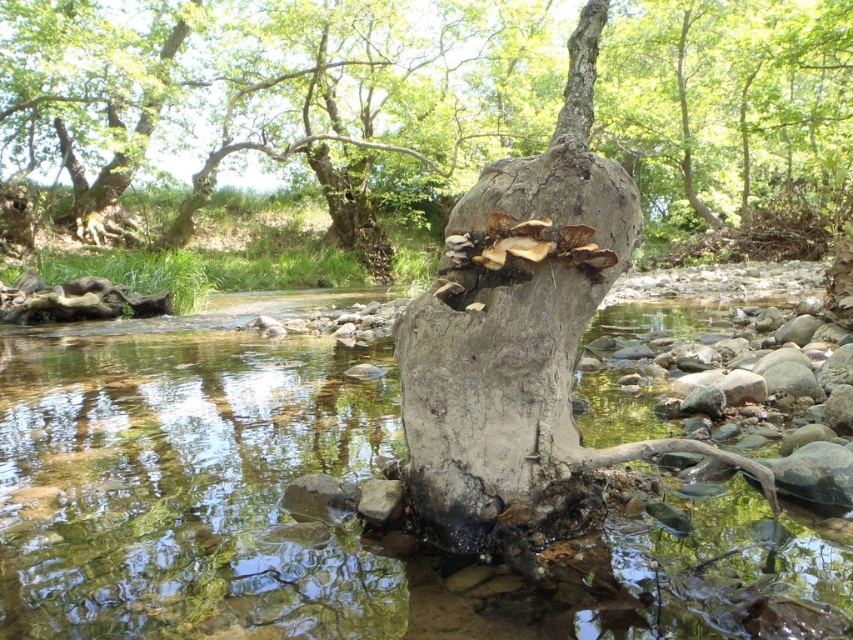
You are a hiker who wants to cross the stream safely. You see the translucent water at tree center and the gray rough bark tree trunk at center. Which object should you step on to avoid getting your feet wet?

You should step on the gray rough bark tree trunk at center because it is above the translucent water at tree center, so stepping there would keep your feet dry.

You are standing at the edge of the stream and see two points in the water. The first point is at coordinates point (338,524) and the second is at point (451,145). Which point is closer to you?

Point (338,524) is closer to the viewer than point (451,145).

You are standing at the edge of the stream and want to cross to the other side. You see the translucent water at tree center and the gray rough bark tree trunk at center. Which object is taller, and would stepping onto the trunk help you cross?

The gray rough bark tree trunk at center is taller than the translucent water at tree center. Stepping onto the trunk would help you cross since it provides a higher elevation than the water level.